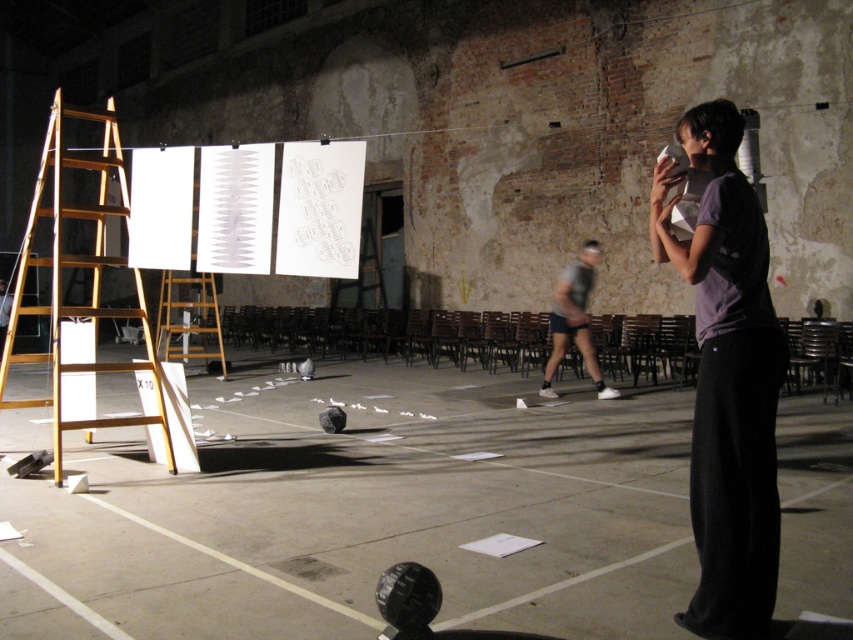
Question: Which object is the closest to the gray fabric shorts at center?

Choices:
 (A) purple cotton shirt at right
 (B) wooden ladder at center

Answer: (A)

Question: Is purple cotton shirt at right wider than wooden ladder at center?

Choices:
 (A) yes
 (B) no

Answer: (B)

Question: Which object is farther from the camera taking this photo?

Choices:
 (A) gray fabric shorts at center
 (B) purple cotton shirt at right

Answer: (A)

Question: Can you confirm if purple cotton shirt at right is thinner than wooden at left?

Choices:
 (A) no
 (B) yes

Answer: (B)

Question: Does wooden at left appear over wooden ladder at center?

Choices:
 (A) no
 (B) yes

Answer: (B)

Question: Which point appears closest to the camera in this image?

Choices:
 (A) (566, 314)
 (B) (732, 282)
 (C) (201, 317)

Answer: (B)